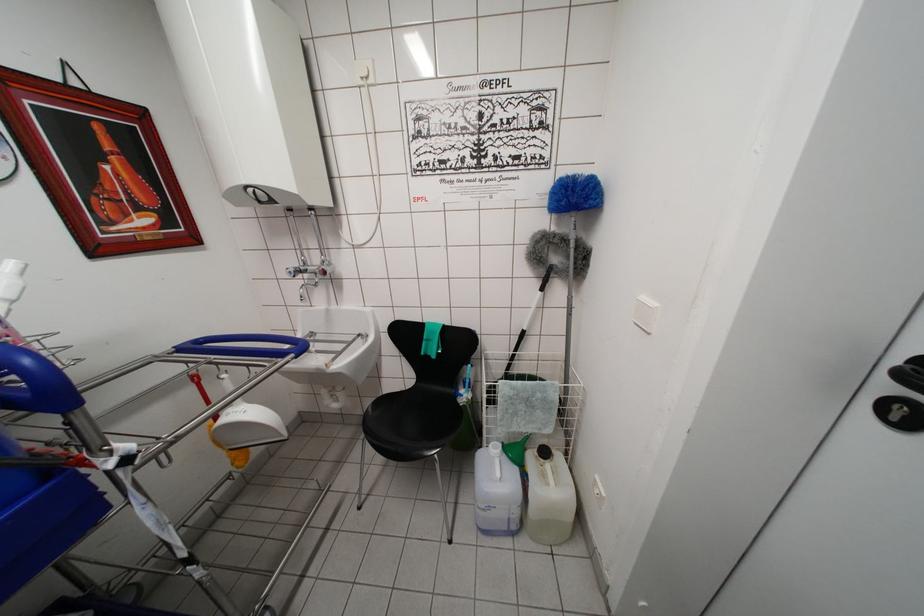
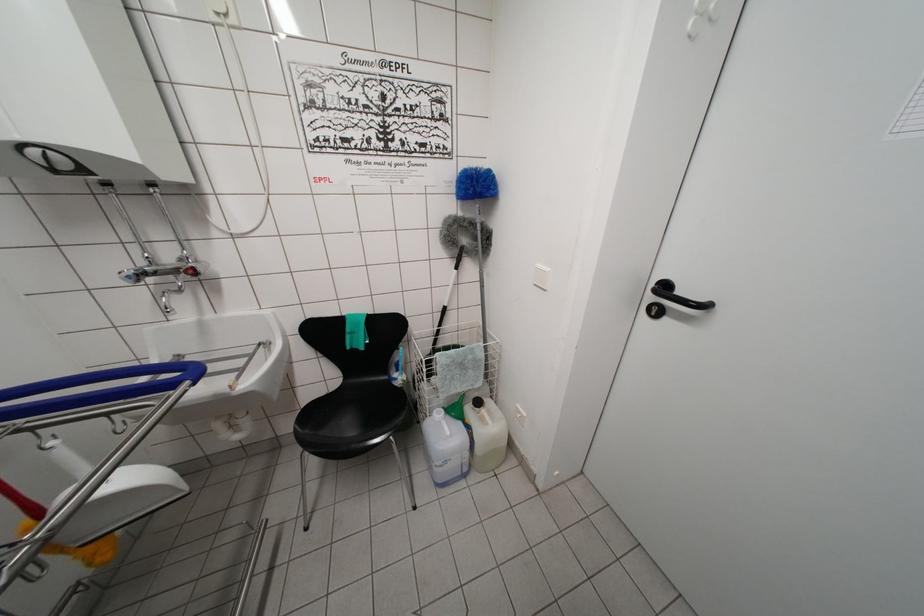
Where in the second image is the point corresponding to the point at 493,450 from the first image?

(438, 418)